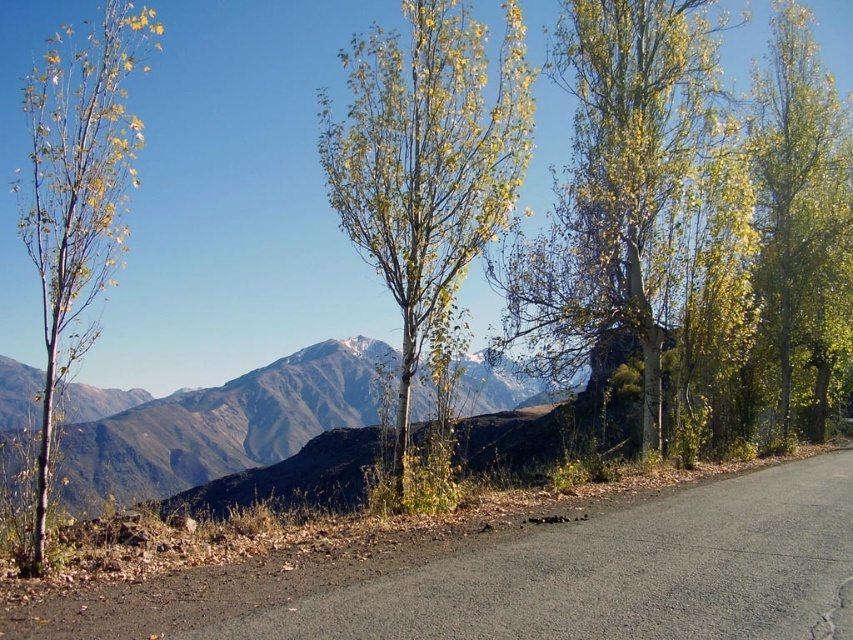
Is green grassy mountain range at left below yellow-green foliage at left?

Yes.

The image size is (853, 640). What do you see at coordinates (222, 426) in the screenshot? I see `green grassy mountain range at left` at bounding box center [222, 426].

At what (x,y) coordinates should I click in order to perform the action: click on green grassy mountain range at left. Please return your answer as a coordinate pair (x, y). Looking at the image, I should click on (222, 426).

Can you confirm if green grassy mountain range at left is bigger than green leafy tree at right?

Indeed, green grassy mountain range at left has a larger size compared to green leafy tree at right.

Does green grassy mountain range at left have a lesser width compared to green leafy tree at right?

No, green grassy mountain range at left is not thinner than green leafy tree at right.

Measure the distance between green grassy mountain range at left and camera.

green grassy mountain range at left and camera are 25.89 feet apart.

Where is `green grassy mountain range at left`? The width and height of the screenshot is (853, 640). green grassy mountain range at left is located at coordinates 222,426.

Which is behind, point (47, 438) or point (811, 145)?

Positioned behind is point (811, 145).

Does yellow-green foliage at left appear on the left side of green leafy tree at right?

Yes, yellow-green foliage at left is to the left of green leafy tree at right.

Between point (65, 253) and point (787, 307), which one is positioned in front?

Point (65, 253)

Identify the location of yellow-green foliage at left. This screenshot has width=853, height=640. (78, 193).